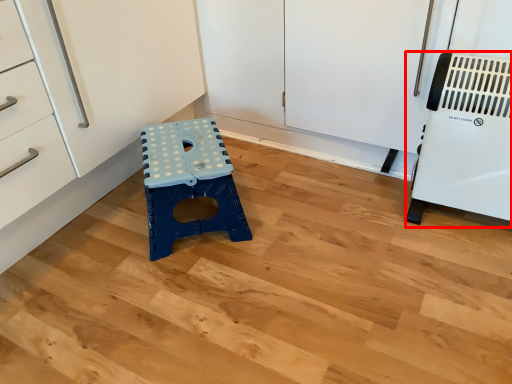
Question: Where is appliance (annotated by the red box) located in relation to furniture in the image?

Choices:
 (A) left
 (B) right

Answer: (B)